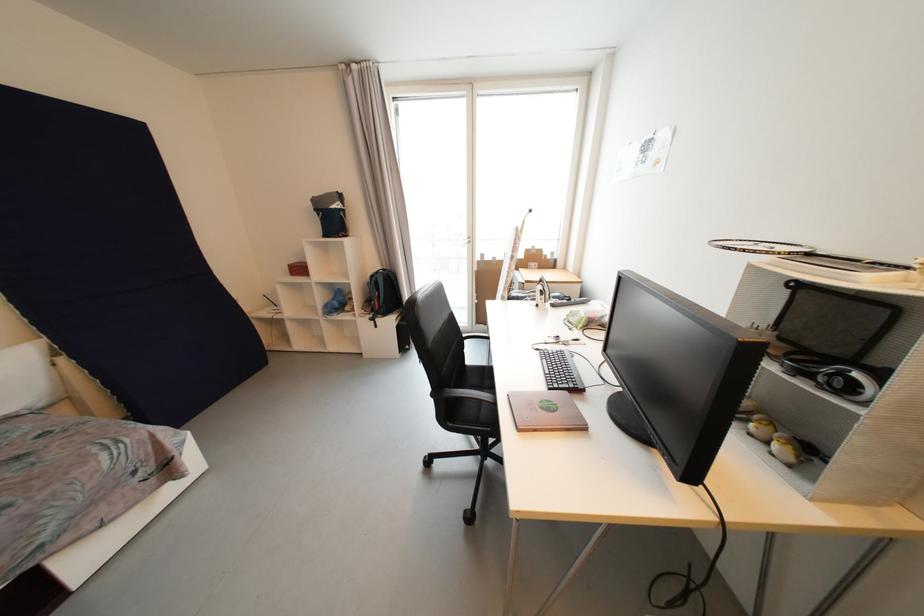
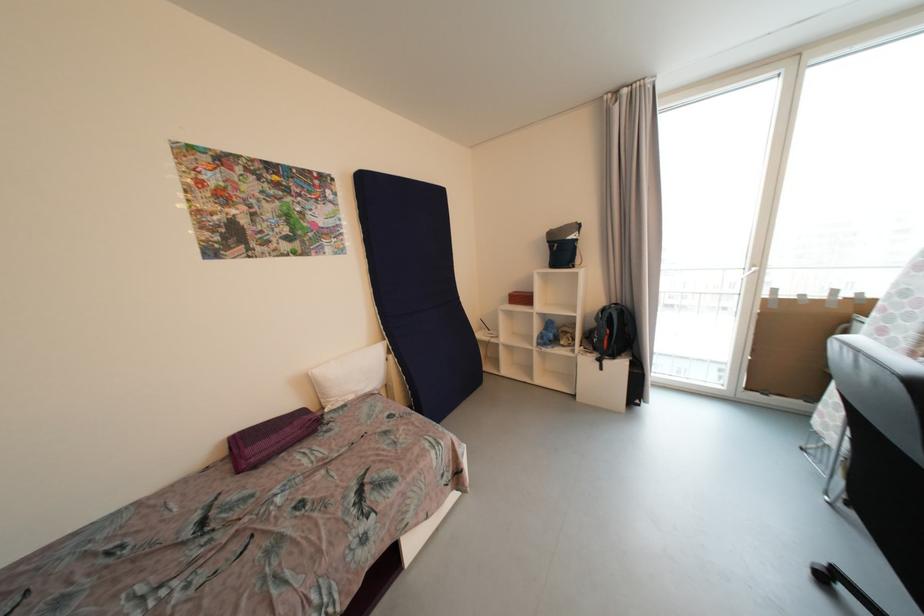
In the second image, find the point that corresponds to point (67, 361) in the first image.

(396, 359)